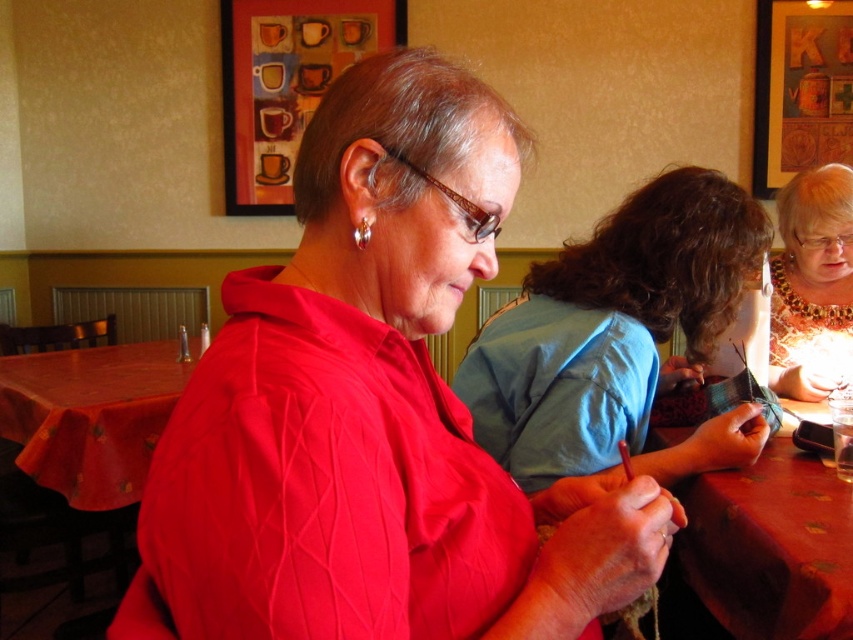
Question: Can you confirm if matte blue shirt at center is positioned to the right of gold beaded necklace at upper right?

Choices:
 (A) yes
 (B) no

Answer: (B)

Question: Is matte blue shirt at center to the right of wooden table at center from the viewer's perspective?

Choices:
 (A) no
 (B) yes

Answer: (A)

Question: Which point is closer to the camera?

Choices:
 (A) smooth orange tablecloth at lower left
 (B) gold beaded necklace at upper right

Answer: (B)

Question: Among these points, which one is nearest to the camera?

Choices:
 (A) (148, 406)
 (B) (467, 237)
 (C) (631, 408)
 (D) (814, 268)

Answer: (B)

Question: Can you confirm if wooden table at center is bigger than smooth orange tablecloth at lower left?

Choices:
 (A) yes
 (B) no

Answer: (B)

Question: Which of the following is the farthest from the observer?

Choices:
 (A) (796, 630)
 (B) (529, 547)

Answer: (A)